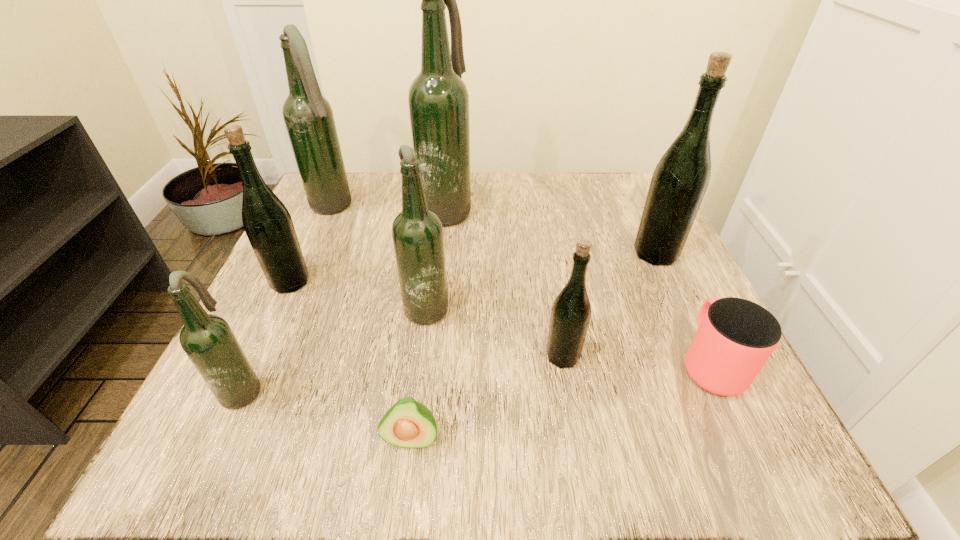
Locate an element on the screen. The image size is (960, 540). the smallest dark beer bottle is located at coordinates (208, 341).

At what (x,y) coordinates should I click in order to perform the action: click on cup. Please return your answer as a coordinate pair (x, y). This screenshot has height=540, width=960. Looking at the image, I should click on pos(735,337).

Where is `green avocado`? The image size is (960, 540). green avocado is located at coordinates (407, 424).

Find the location of a particular element. Image resolution: width=960 pixels, height=540 pixels. the nearest object is located at coordinates (407, 424).

This screenshot has width=960, height=540. In order to click on free space located on the right of the biggest dark beer bottle in this screenshot , I will do `click(599, 209)`.

Identify the location of free space located 0.320m on the front of the farthest green beer bottle. Image resolution: width=960 pixels, height=540 pixels. (732, 417).

This screenshot has height=540, width=960. Find the location of `free space located on the front of the third smallest dark beer bottle`. free space located on the front of the third smallest dark beer bottle is located at coordinates (290, 302).

The height and width of the screenshot is (540, 960). What are the coordinates of `free space located 0.230m on the front of the second farthest green beer bottle` in the screenshot? It's located at (230, 409).

Locate an element on the screen. The height and width of the screenshot is (540, 960). vacant space located on the back of the third farthest dark beer bottle is located at coordinates (438, 222).

This screenshot has height=540, width=960. What are the coordinates of `free space located 0.290m on the left of the sixth beer bottle from left to right` in the screenshot? It's located at (361, 356).